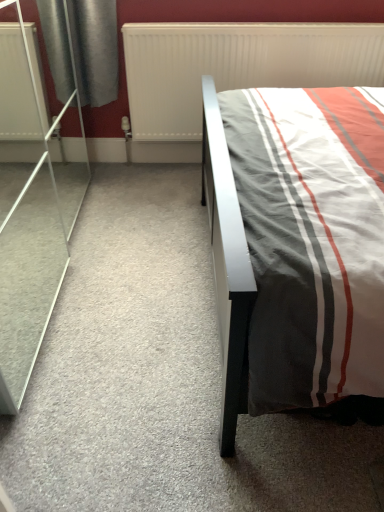
In order to face white textured radiator at upper center, should I rotate leftwards or rightwards?

To face it directly, rotate right by 7.867 degrees.

At what (x,y) coordinates should I click in order to perform the action: click on white textured radiator at upper center. Please return your answer as a coordinate pair (x, y). Looking at the image, I should click on (237, 66).

This screenshot has width=384, height=512. What do you see at coordinates (237, 66) in the screenshot?
I see `white textured radiator at upper center` at bounding box center [237, 66].

This screenshot has height=512, width=384. Identify the location of transparent glass screen door at left. (31, 205).

Describe the element at coordinates (31, 205) in the screenshot. I see `transparent glass screen door at left` at that location.

Find the location of a particular element. The image size is (384, 512). white textured radiator at upper center is located at coordinates (237, 66).

From the picture: Can you confirm if transparent glass screen door at left is positioned to the right of white textured radiator at upper center?

No, transparent glass screen door at left is not to the right of white textured radiator at upper center.

Which object is further away from the camera taking this photo, transparent glass screen door at left or white textured radiator at upper center?

Positioned behind is white textured radiator at upper center.

Which point is more forward, [19,151] or [145,116]?

The point [145,116] is closer to the camera.

From the image's perspective, between transparent glass screen door at left and white textured radiator at upper center, who is located below?

transparent glass screen door at left.

From a real-world perspective, is transparent glass screen door at left positioned above or below white textured radiator at upper center?

In terms of real-world spatial position, transparent glass screen door at left is above white textured radiator at upper center.

Is transparent glass screen door at left thinner than white textured radiator at upper center?

No, transparent glass screen door at left is not thinner than white textured radiator at upper center.

In the scene shown: Does transparent glass screen door at left have a lesser height compared to white textured radiator at upper center?

No, transparent glass screen door at left is not shorter than white textured radiator at upper center.

Between transparent glass screen door at left and white textured radiator at upper center, which one has smaller size?

white textured radiator at upper center.

Could white textured radiator at upper center be considered to be inside transparent glass screen door at left?

Definitely not — white textured radiator at upper center is not inside transparent glass screen door at left.

Would you consider transparent glass screen door at left to be distant from white textured radiator at upper center?

No, transparent glass screen door at left is not far from white textured radiator at upper center.

Is transparent glass screen door at left looking in the opposite direction of white textured radiator at upper center?

No, transparent glass screen door at left is not facing away from white textured radiator at upper center.

How much distance is there between transparent glass screen door at left and white textured radiator at upper center?

transparent glass screen door at left and white textured radiator at upper center are 79.06 centimeters apart.

This screenshot has height=512, width=384. What are the coordinates of `screen door below the white textured radiator at upper center (from the image's perspective)` in the screenshot? It's located at (31, 205).

In the image, is white textured radiator at upper center on the left side or the right side of transparent glass screen door at left?

Clearly, white textured radiator at upper center is on the right of transparent glass screen door at left in the image.

Is the position of white textured radiator at upper center less distant than that of transparent glass screen door at left?

No.

Is point (187, 127) closer to viewer compared to point (9, 137)?

No, (187, 127) is further to viewer.

From the image's perspective, who appears lower, white textured radiator at upper center or transparent glass screen door at left?

transparent glass screen door at left, from the image's perspective.

From a real-world perspective, is white textured radiator at upper center positioned above or below transparent glass screen door at left?

Clearly, from a real-world perspective, white textured radiator at upper center is below transparent glass screen door at left.

Does white textured radiator at upper center have a greater width compared to transparent glass screen door at left?

No.

Between white textured radiator at upper center and transparent glass screen door at left, which one has less height?

Standing shorter between the two is white textured radiator at upper center.

Between white textured radiator at upper center and transparent glass screen door at left, which one has smaller size?

Smaller between the two is white textured radiator at upper center.

Based on the photo, is white textured radiator at upper center located outside transparent glass screen door at left?

Yes, white textured radiator at upper center is not within transparent glass screen door at left.

Is white textured radiator at upper center far away from transparent glass screen door at left?

No, there isn't a large distance between white textured radiator at upper center and transparent glass screen door at left.

Is white textured radiator at upper center turned away from transparent glass screen door at left?

No, transparent glass screen door at left is not at the back of white textured radiator at upper center.

Where is `radiator above the transparent glass screen door at left (from the image's perspective)`? This screenshot has height=512, width=384. radiator above the transparent glass screen door at left (from the image's perspective) is located at coordinates (237, 66).

I want to click on screen door in front of the white textured radiator at upper center, so click(31, 205).

Identify the location of radiator on the right of transparent glass screen door at left. (237, 66).